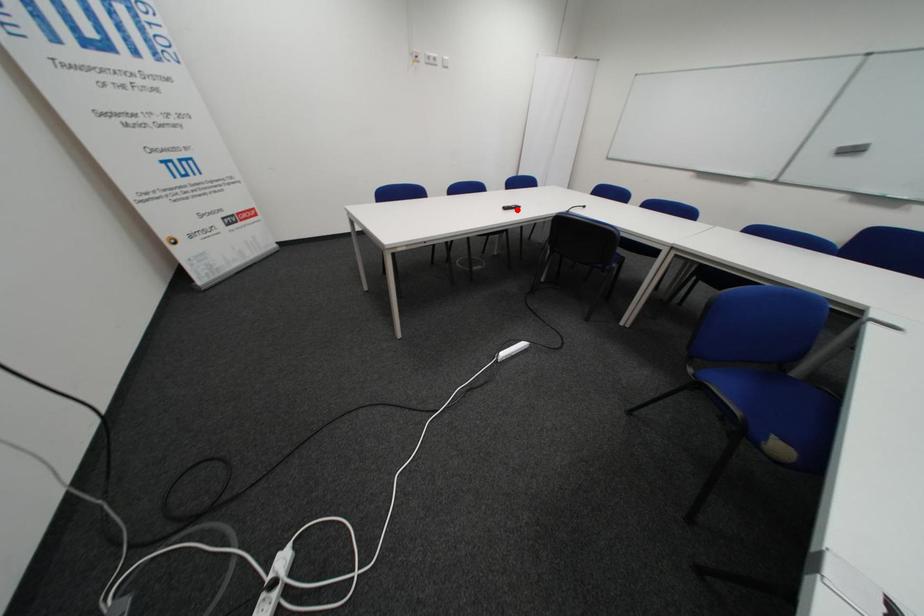
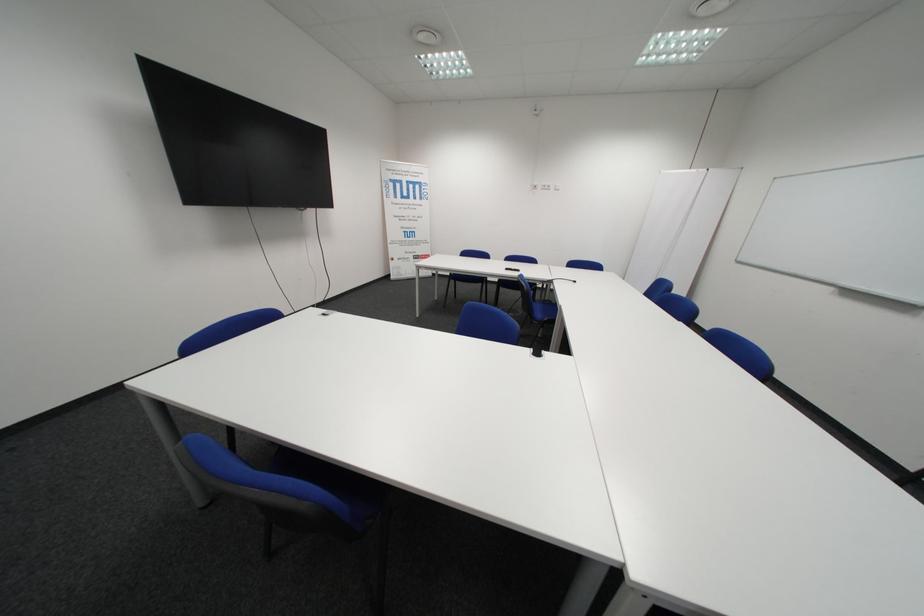
Question: I am providing you with two images of the same scene from different viewpoints. A red point is shown in image1. For the corresponding object point in image2, is it positioned nearer or farther from the camera?

Choices:
 (A) Nearer
 (B) Farther

Answer: (B)